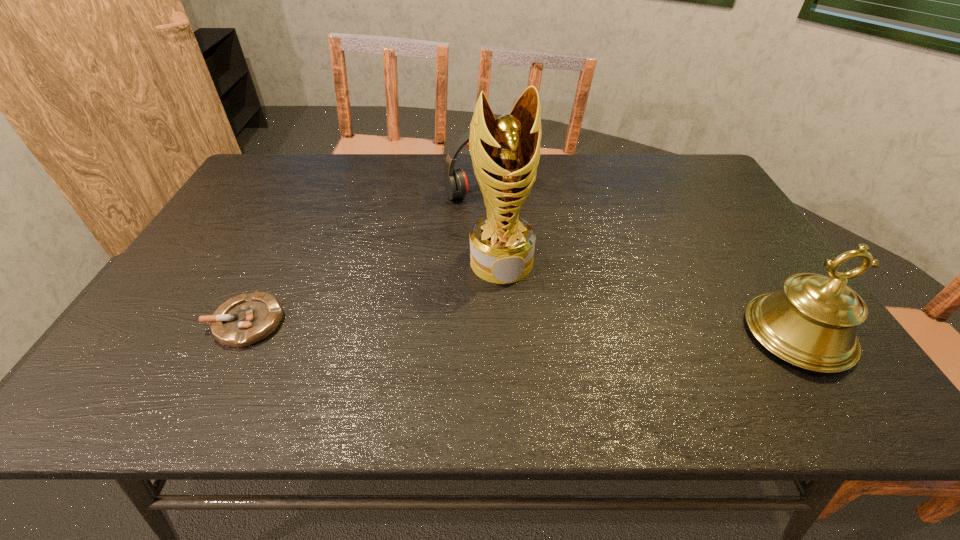
Locate an element on the screen. This screenshot has height=540, width=960. object present at the right edge is located at coordinates (811, 323).

At what (x,y) coordinates should I click in order to perform the action: click on object that is at the near left corner. Please return your answer as a coordinate pair (x, y). The width and height of the screenshot is (960, 540). Looking at the image, I should click on (246, 319).

This screenshot has height=540, width=960. What are the coordinates of `object that is at the near right corner` in the screenshot? It's located at (811, 323).

At what (x,y) coordinates should I click in order to perform the action: click on vacant space at the far edge of the desktop. Please return your answer as a coordinate pair (x, y). Looking at the image, I should click on (324, 187).

This screenshot has height=540, width=960. I want to click on vacant space at the near edge, so click(x=586, y=361).

In the image, there is a desktop. In order to click on free space at the left edge in this screenshot , I will do `click(171, 290)`.

At what (x,y) coordinates should I click in order to perform the action: click on vacant space at the right edge. Please return your answer as a coordinate pair (x, y). Image resolution: width=960 pixels, height=540 pixels. Looking at the image, I should click on (746, 225).

Identify the location of vacant space at the far left corner of the desktop. click(x=299, y=169).

Identify the location of vacant region at the near left corner. The image size is (960, 540). (191, 340).

Image resolution: width=960 pixels, height=540 pixels. Identify the location of free space between the shortest object and the rightmost object. tap(522, 328).